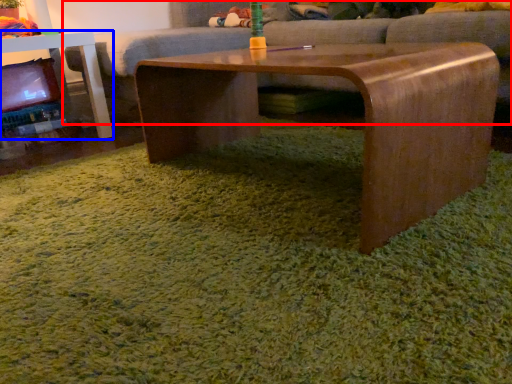
Question: Which object appears farthest to the camera in this image, studio couch (highlighted by a red box) or table (highlighted by a blue box)?

Choices:
 (A) studio couch
 (B) table

Answer: (A)